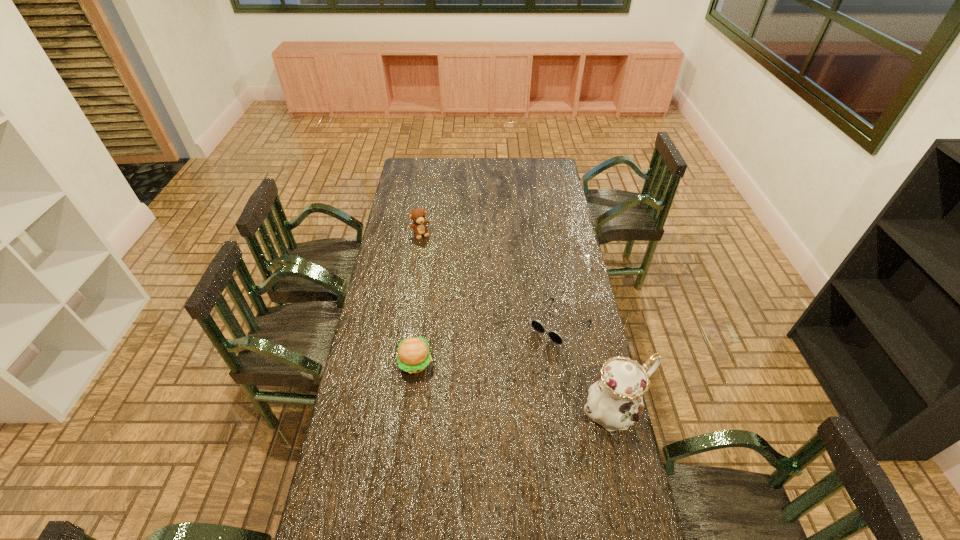
Where is `free space on the desktop that is between the hamburger and the nearest object and is positioned on the front-facing side of the sunglasses`? free space on the desktop that is between the hamburger and the nearest object and is positioned on the front-facing side of the sunglasses is located at coordinates (x=501, y=383).

Image resolution: width=960 pixels, height=540 pixels. I want to click on free spot on the desktop that is between the hamburger and the tallest object and is positioned on the face of the teddy bear, so click(502, 383).